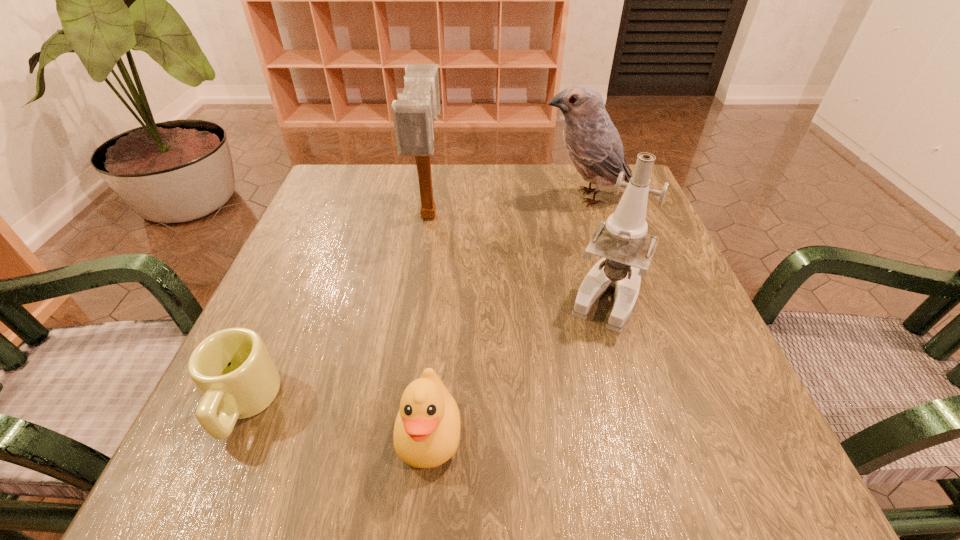
This screenshot has width=960, height=540. I want to click on free space in the image that satisfies the following two spatial constraints: 1. on the front-facing side of the parrot; 2. at the beak of the duck, so click(660, 433).